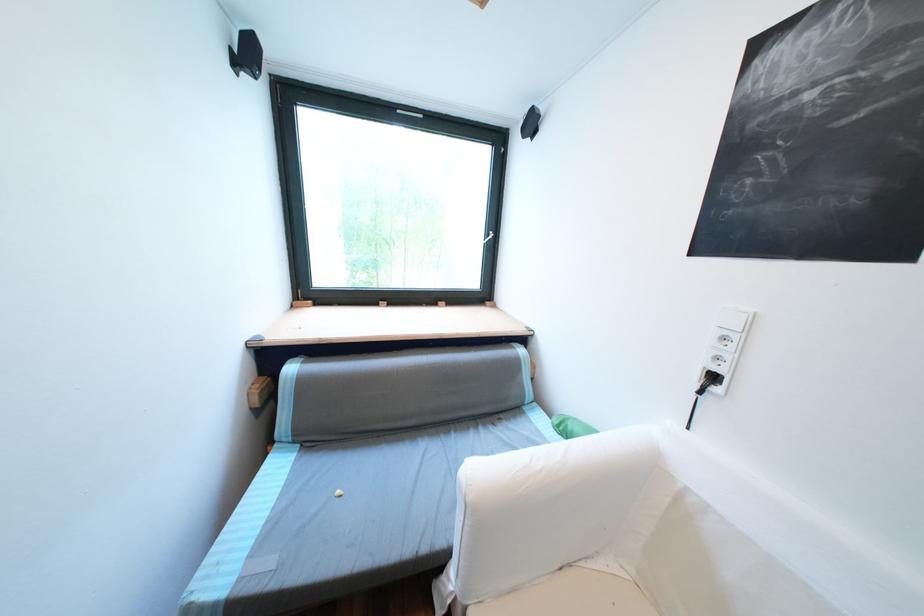
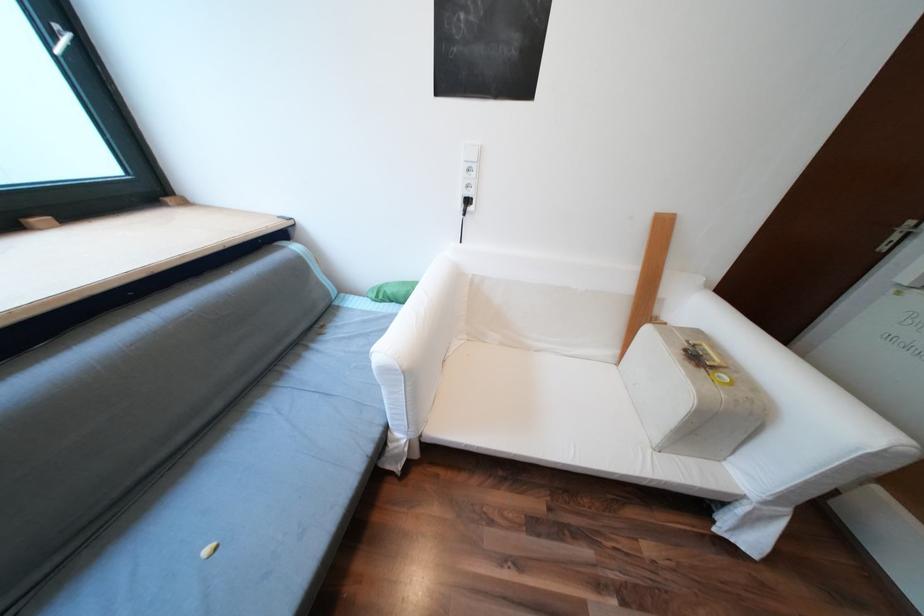
Based on the continuous images, in which direction is the camera rotating?

The camera's rotation is toward right-down.